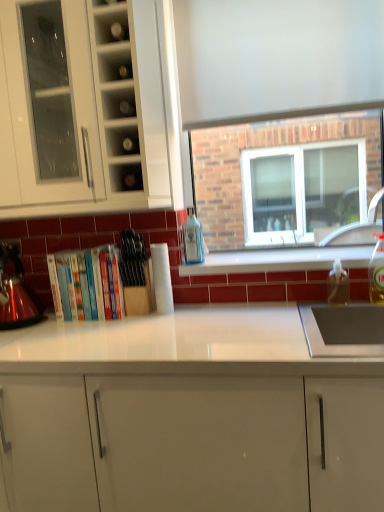
Find the location of a particular element. empty space that is to the right of blue glass bottle at center, which is the 3th bottle in front-to-back order is located at coordinates (228, 264).